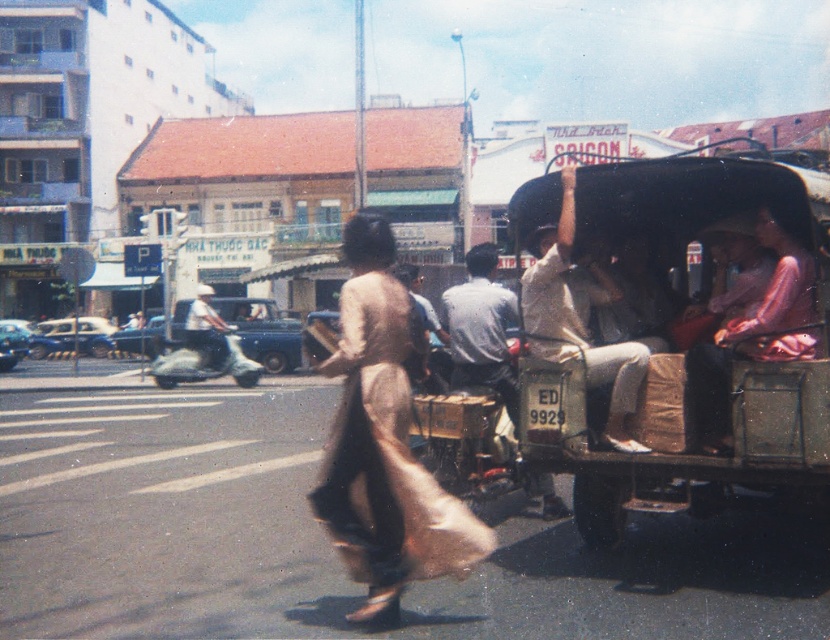
Can you confirm if pink satin dress at center is smaller than light brown shirt at center?

Yes.

Can you confirm if pink satin dress at center is bigger than light brown shirt at center?

No, pink satin dress at center is not bigger than light brown shirt at center.

The image size is (830, 640). Find the location of `pink satin dress at center`. pink satin dress at center is located at coordinates (750, 320).

Can you confirm if wooden cart at right is bigger than pink satin dress at center?

Indeed, wooden cart at right has a larger size compared to pink satin dress at center.

Does wooden cart at right have a lesser width compared to pink satin dress at center?

Incorrect, wooden cart at right's width is not less than pink satin dress at center's.

You are a GUI agent. You are given a task and a screenshot of the screen. Output one action in this format:
    pyautogui.click(x=<x>, y=<y>)
    Task: Click on the wooden cart at right
    The height and width of the screenshot is (640, 830).
    Given the screenshot: What is the action you would take?
    pyautogui.click(x=677, y=332)

Does light brown silk ao dai at center have a lesser height compared to light beige fabric shirt at center?

In fact, light brown silk ao dai at center may be taller than light beige fabric shirt at center.

Which is behind, point (344, 554) or point (536, 316)?

Positioned behind is point (536, 316).

Which is behind, point (370, 554) or point (535, 337)?

The point (535, 337) is more distant.

Where is `light brown silk ao dai at center`? The height and width of the screenshot is (640, 830). light brown silk ao dai at center is located at coordinates (370, 426).